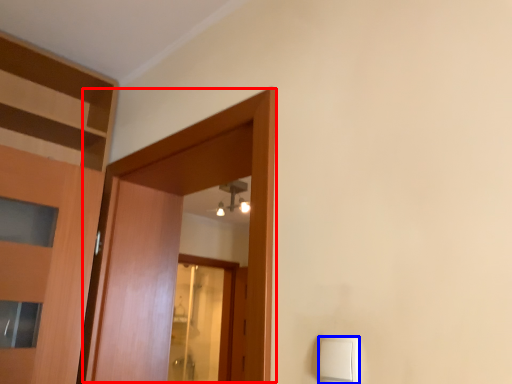
Question: Which object appears closest to the camera in this image, door (highlighted by a red box) or light switch (highlighted by a blue box)?

Choices:
 (A) door
 (B) light switch

Answer: (B)